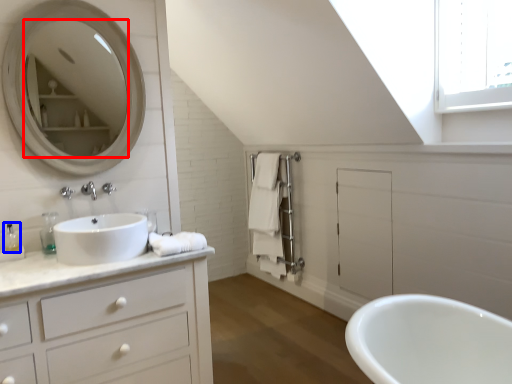
Question: Which point is closer to the camera, mirror (highlighted by a red box) or toiletry (highlighted by a blue box)?

Choices:
 (A) mirror
 (B) toiletry

Answer: (A)